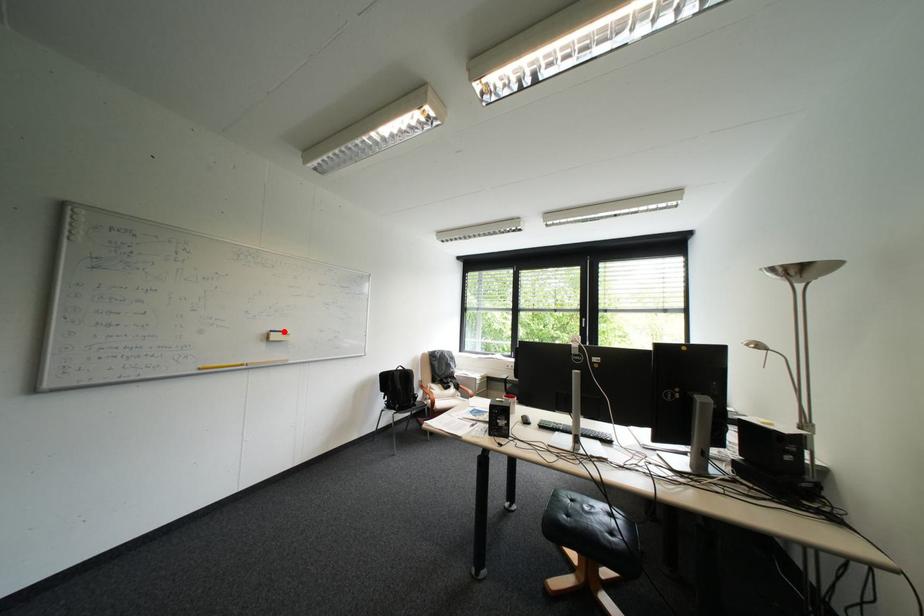
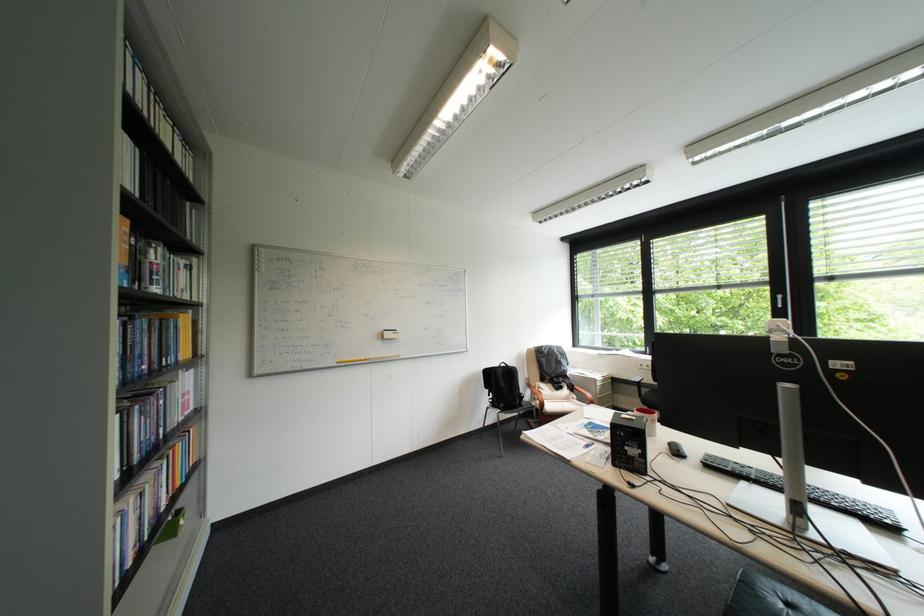
The point at the highlighted location is marked in the first image. Where is the corresponding point in the second image?

(397, 331)